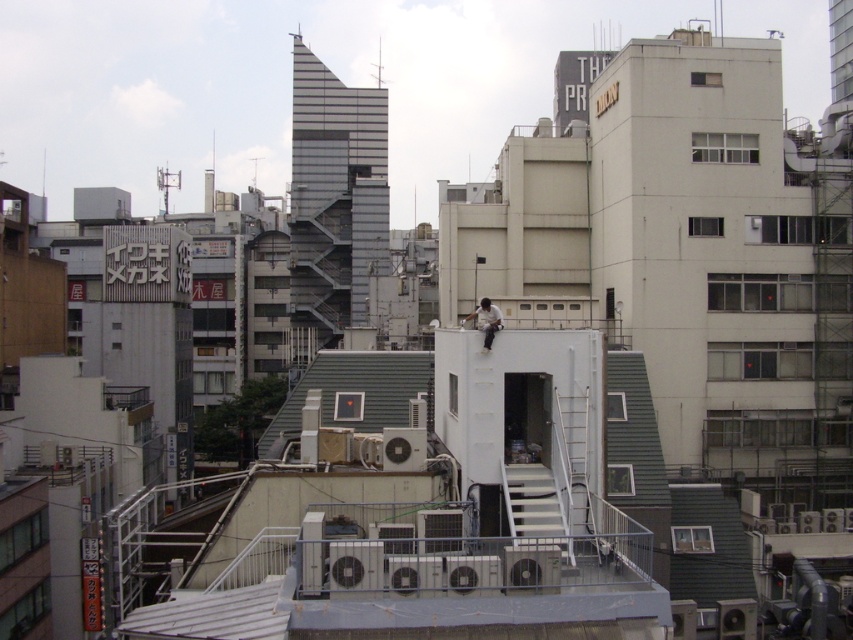
Question: Is the position of green matte roof at center less distant than that of white matte shirt at center?

Choices:
 (A) yes
 (B) no

Answer: (B)

Question: Is green matte roof at center smaller than white matte shirt at center?

Choices:
 (A) yes
 (B) no

Answer: (B)

Question: Is green matte roof at center thinner than white matte shirt at center?

Choices:
 (A) yes
 (B) no

Answer: (B)